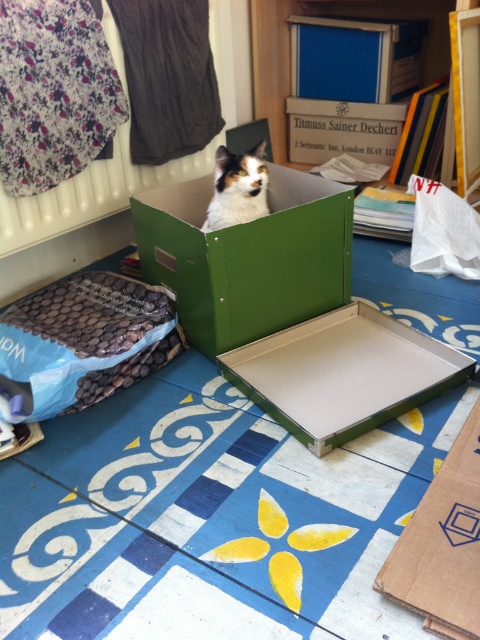
Question: Is the position of green cardboard box at center more distant than that of calico fur cat at center?

Choices:
 (A) yes
 (B) no

Answer: (B)

Question: Which of the following is the closest to the observer?

Choices:
 (A) green cardboard tray at center
 (B) green cardboard box at center

Answer: (A)

Question: Based on their relative distances, which object is farther from the calico fur cat at center?

Choices:
 (A) brown cardboard box at lower right
 (B) green cardboard tray at center
 (C) green cardboard box at center

Answer: (A)

Question: Can you confirm if green cardboard tray at center is smaller than brown cardboard box at lower right?

Choices:
 (A) yes
 (B) no

Answer: (B)

Question: Can you confirm if green cardboard box at center is thinner than brown cardboard box at lower right?

Choices:
 (A) no
 (B) yes

Answer: (A)

Question: Among these objects, which one is farthest from the camera?

Choices:
 (A) green cardboard tray at center
 (B) brown cardboard box at lower right
 (C) green cardboard box at center

Answer: (C)